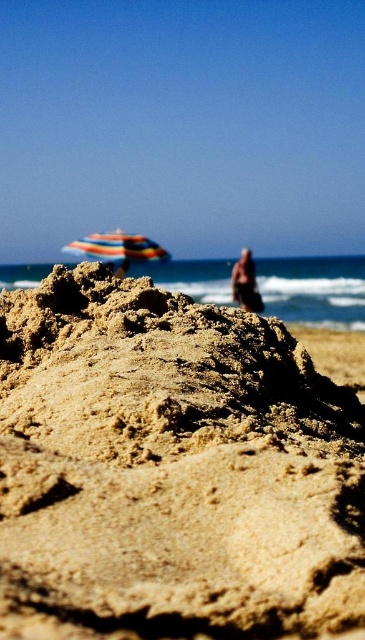
You are a photographer trying to capture the sandcastle and the beach umbrella in your shot. You notice two points marked on your camera screen at coordinates point (155, 253) and point (233, 298). Which point is closer to your camera lens?

Point (155, 253) is further to the camera than point (233, 298), so the point closer to the camera lens is point (155, 253).